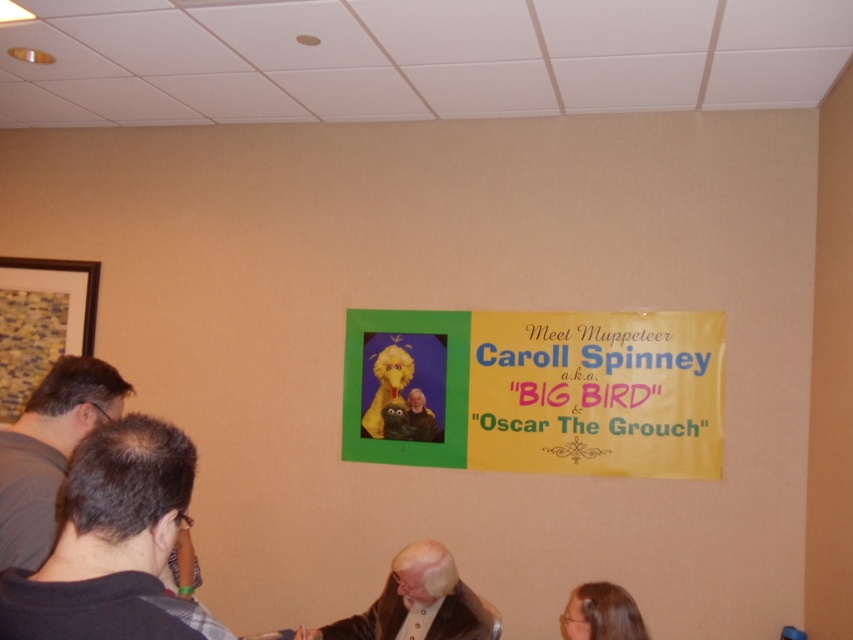
Question: Which is nearer to the white textured suit at lower center?

Choices:
 (A) yellow paper at upper center
 (B) dark gray hair at lower left

Answer: (A)

Question: Which of the following is the closest to the observer?

Choices:
 (A) (398, 596)
 (B) (627, 328)
 (C) (158, 566)
 (D) (15, 483)

Answer: (C)

Question: Is dark gray hair at left to the right of white textured suit at lower center from the viewer's perspective?

Choices:
 (A) no
 (B) yes

Answer: (A)

Question: Is dark gray hair at lower left bigger than dark gray hair at left?

Choices:
 (A) yes
 (B) no

Answer: (B)

Question: Does dark gray hair at left appear on the left side of white textured suit at lower center?

Choices:
 (A) yes
 (B) no

Answer: (A)

Question: Which of the following is the farthest from the observer?

Choices:
 (A) dark gray hair at lower left
 (B) yellow paper at upper center
 (C) white textured suit at lower center

Answer: (B)